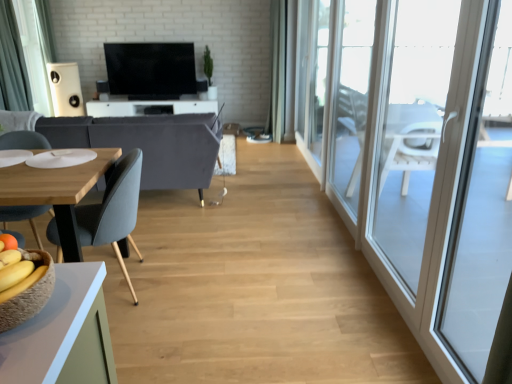
Image resolution: width=512 pixels, height=384 pixels. What are the coordinates of `free location to the right of matte gray chair at left` in the screenshot? It's located at (188, 286).